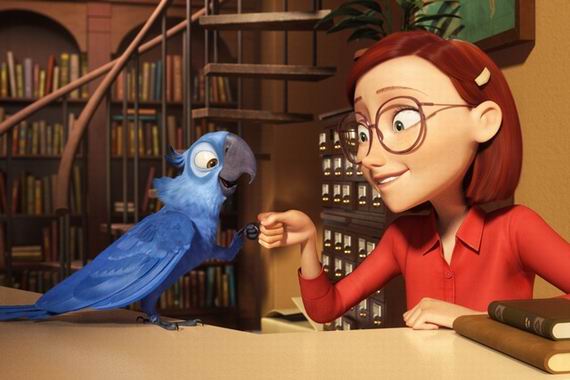
Where is `countertop`? The image size is (570, 380). countertop is located at coordinates (308, 364).